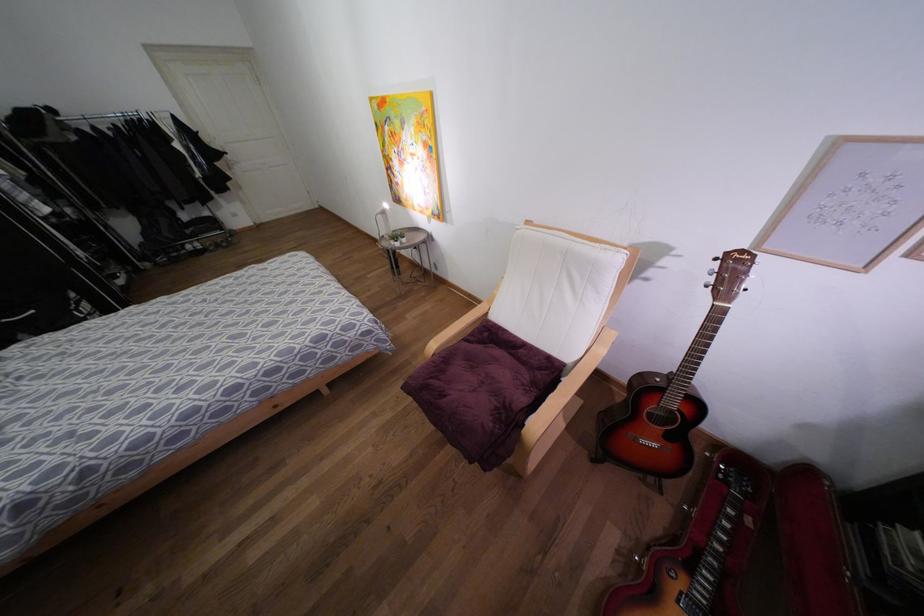
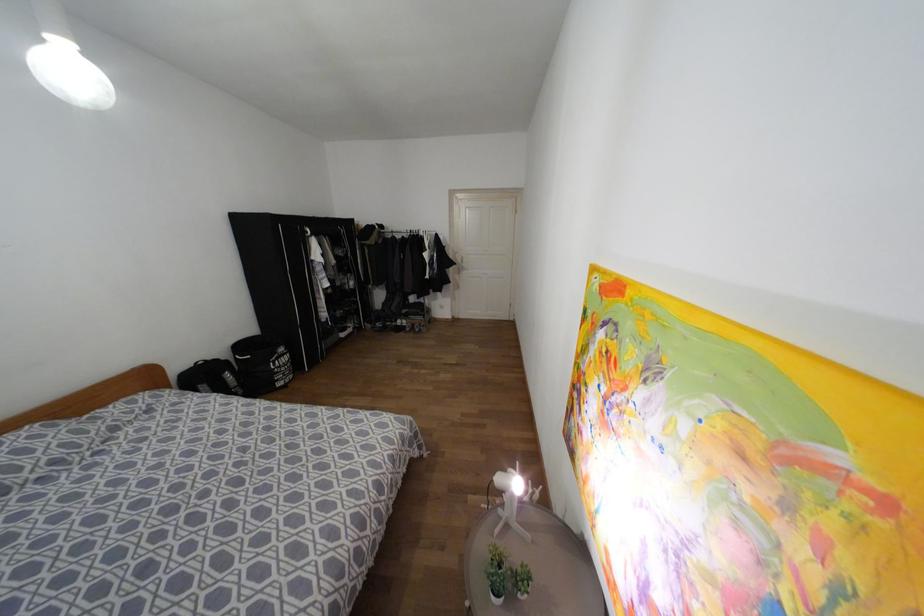
Question: I am providing you with two images of the same scene from different viewpoints. Which of the following objects are not visible in image2?

Choices:
 (A) wardrobe zipper pull
 (B) white door handle
 (C) white desk lamp
 (D) none of these

Answer: (D)